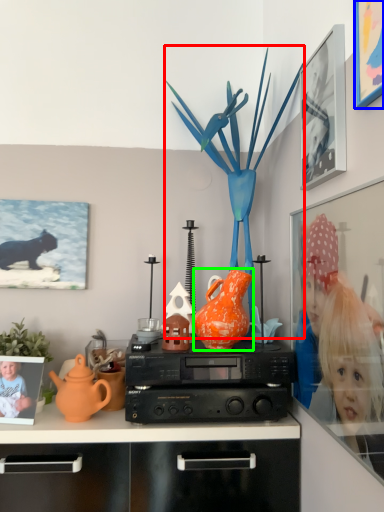
Question: Which object is positioned farthest from toy (highlighted by a red box)? Select from picture frame (highlighted by a blue box) and vase (highlighted by a green box).

Choices:
 (A) picture frame
 (B) vase

Answer: (A)